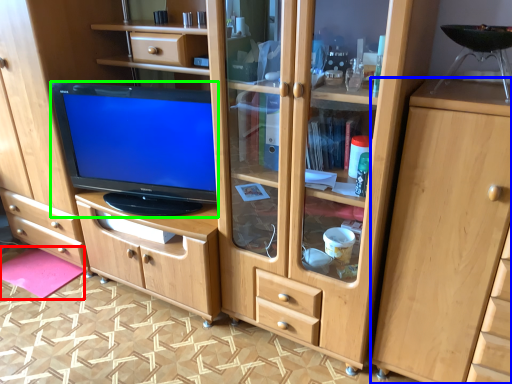
Question: Which object is the farthest from flat (highlighted by a red box)? Choose among these: cabinetry (highlighted by a blue box) or television (highlighted by a green box).

Choices:
 (A) cabinetry
 (B) television

Answer: (A)